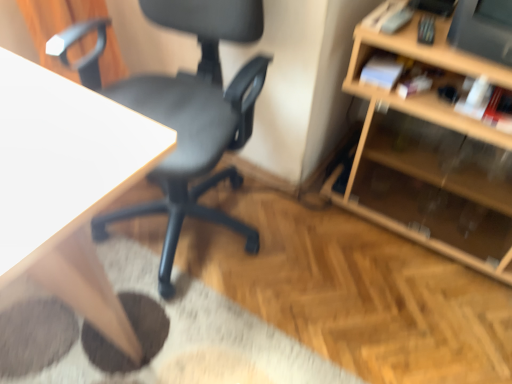
Question: From the image's perspective, is wooden shelf at right above or below white wood desk at upper left?

Choices:
 (A) above
 (B) below

Answer: (A)

Question: Visually, is wooden shelf at right positioned to the left or to the right of white wood desk at upper left?

Choices:
 (A) right
 (B) left

Answer: (A)

Question: Estimate the real-world distances between objects in this image. Which object is farther from the wooden shelf at right?

Choices:
 (A) black plastic chair at center
 (B) white wood desk at upper left

Answer: (B)

Question: Which object is positioned farthest from the wooden shelf at right?

Choices:
 (A) white wood desk at upper left
 (B) black plastic chair at center

Answer: (A)